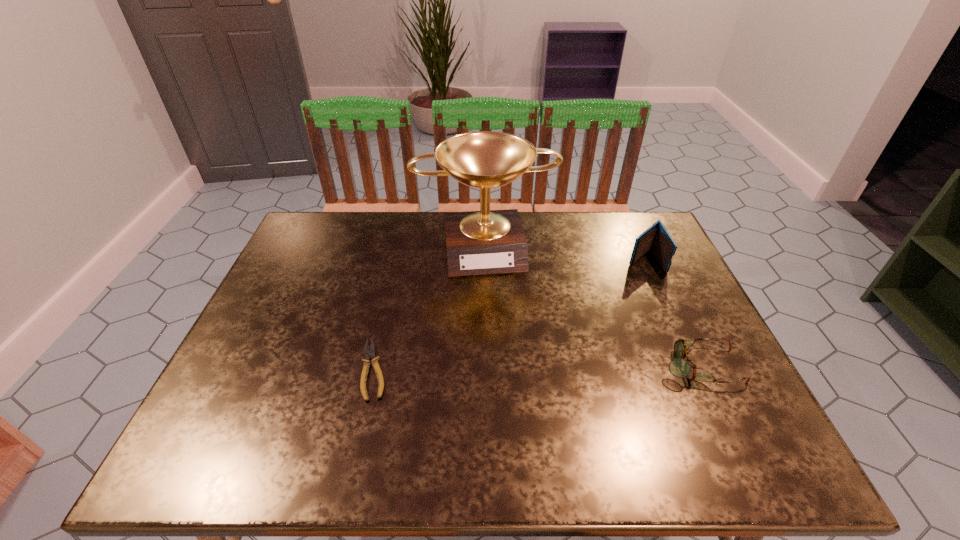
Locate an element on the screen. The image size is (960, 540). the shortest object is located at coordinates (370, 353).

At what (x,y) coordinates should I click in order to perform the action: click on the leftmost object. Please return your answer as a coordinate pair (x, y). This screenshot has height=540, width=960. Looking at the image, I should click on (370, 353).

Where is `the third tallest object`? The image size is (960, 540). the third tallest object is located at coordinates click(679, 367).

Locate an element on the screen. The height and width of the screenshot is (540, 960). wallet is located at coordinates (656, 237).

Image resolution: width=960 pixels, height=540 pixels. Find the location of `award`. award is located at coordinates (488, 241).

This screenshot has height=540, width=960. I want to click on the tallest object, so click(488, 241).

What are the coordinates of `vacant position located 0.350m on the right of the leftmost object` in the screenshot? It's located at [x=543, y=369].

I want to click on free point located on the exterior surface of the second tallest object, so click(610, 291).

Identify the location of free space located 0.150m on the exterior surface of the second tallest object. The width and height of the screenshot is (960, 540). (605, 294).

At what (x,y) coordinates should I click in order to perform the action: click on free space located 0.360m on the exterior surface of the second tallest object. Please return your answer as a coordinate pair (x, y). The image size is (960, 540). Looking at the image, I should click on (555, 335).